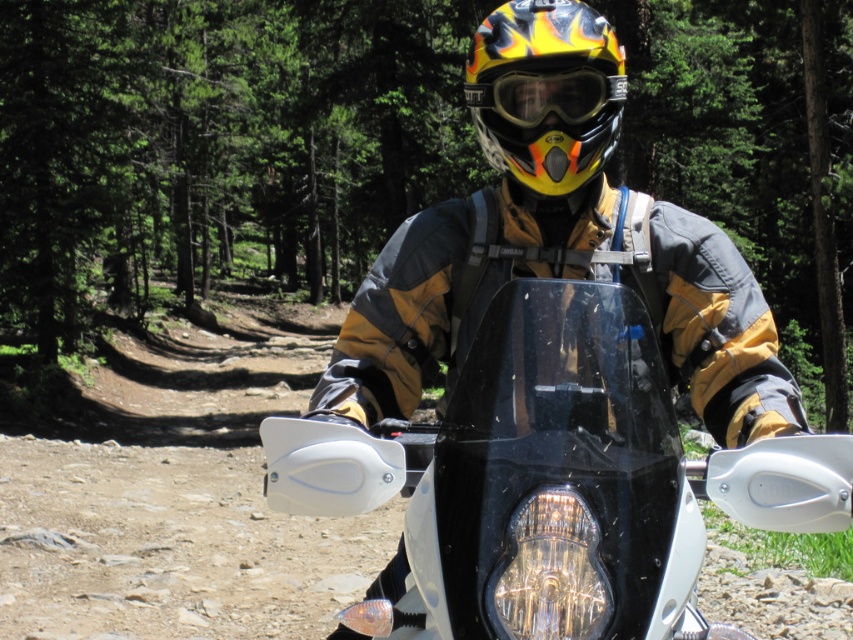
Who is shorter, flame-patterned plastic helmet at center or yellow matte/glossy goggles at center?

yellow matte/glossy goggles at center is shorter.

Who is more forward, (x=543, y=51) or (x=537, y=72)?

Point (x=543, y=51) is more forward.

Find the location of a particular element. The height and width of the screenshot is (640, 853). flame-patterned plastic helmet at center is located at coordinates (546, 92).

Does green leafy pine forest at upper center appear on the right side of flame-patterned plastic helmet at center?

Result: No, green leafy pine forest at upper center is not to the right of flame-patterned plastic helmet at center.

You are a GUI agent. You are given a task and a screenshot of the screen. Output one action in this format:
    pyautogui.click(x=<x>, y=<y>)
    Task: Click on the green leafy pine forest at upper center
    
    Given the screenshot: What is the action you would take?
    pyautogui.click(x=216, y=147)

Identify the location of green leafy pine forest at upper center. (216, 147).

Is point (526, 436) behind point (610, 125)?

No, (526, 436) is in front of (610, 125).

Is point (611, 410) less distant than point (543, 172)?

Yes, it is in front of point (543, 172).

Which is in front, point (520, 420) or point (567, 33)?

Positioned in front is point (520, 420).

You are a GUI agent. You are given a task and a screenshot of the screen. Output one action in this format:
    pyautogui.click(x=<x>, y=<y>)
    Task: Click on the black plastic motorcycle at center
    Image resolution: width=853 pixels, height=640 pixels.
    Given the screenshot: What is the action you would take?
    pyautogui.click(x=552, y=481)